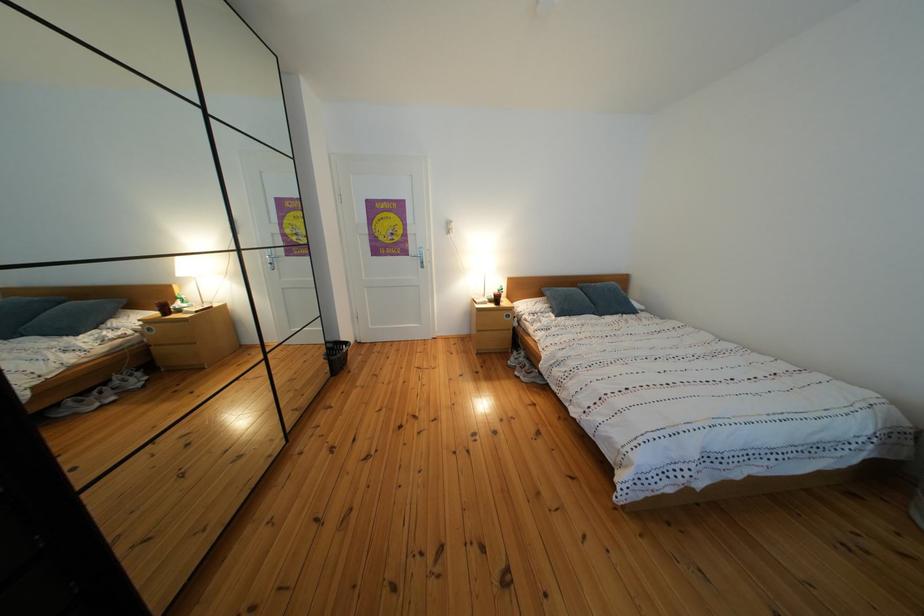
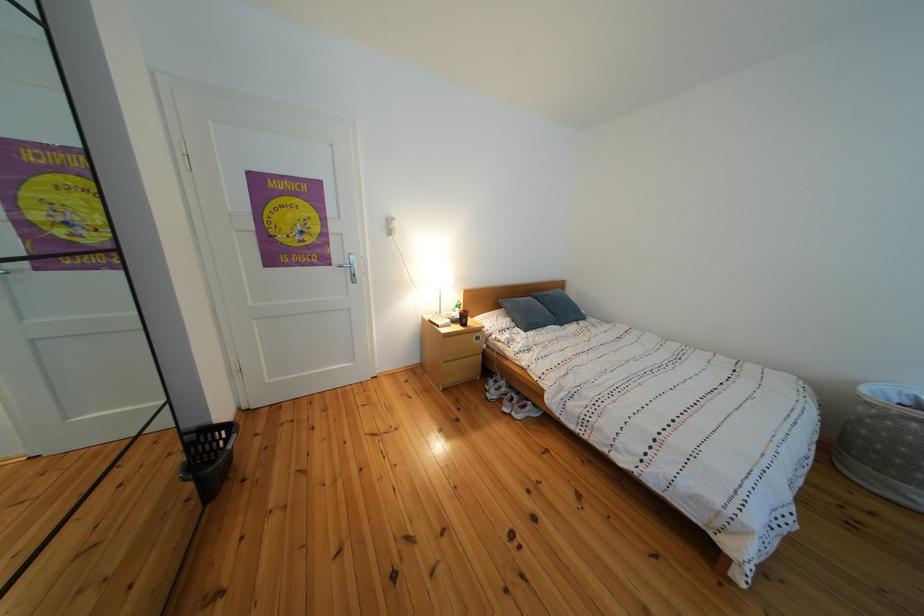
Where in the second image is the point corresponding to [527,359] from the first image?

(503, 387)